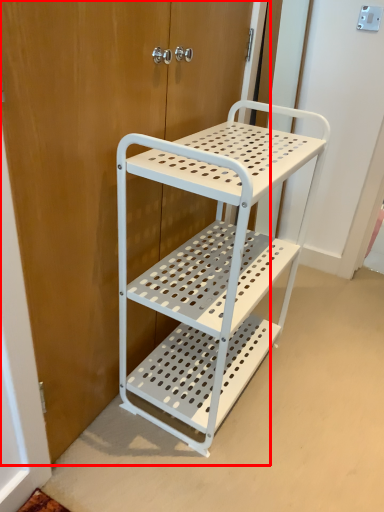
Question: From the image, what is the correct spatial relationship of door (annotated by the red box) in relation to furniture?

Choices:
 (A) left
 (B) right

Answer: (A)